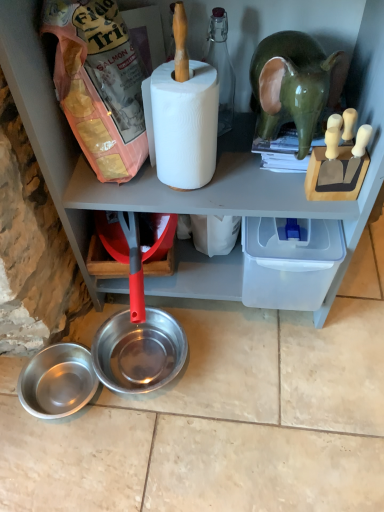
Question: Would you say green glossy elephant at upper right is outside white matte paper towel at center?

Choices:
 (A) yes
 (B) no

Answer: (A)

Question: Can you confirm if green glossy elephant at upper right is positioned to the left of white matte paper towel at center?

Choices:
 (A) no
 (B) yes

Answer: (A)

Question: From the image's perspective, does green glossy elephant at upper right appear lower than white matte paper towel at center?

Choices:
 (A) yes
 (B) no

Answer: (B)

Question: From a real-world perspective, is green glossy elephant at upper right beneath white matte paper towel at center?

Choices:
 (A) no
 (B) yes

Answer: (B)

Question: Is green glossy elephant at upper right oriented away from white matte paper towel at center?

Choices:
 (A) no
 (B) yes

Answer: (A)

Question: Choose the correct answer: Is white matte paper towel at center inside brushed metal bowl at lower left, the 1th bowl positioned from the left, or outside it?

Choices:
 (A) inside
 (B) outside

Answer: (B)

Question: In terms of width, does white matte paper towel at center look wider or thinner when compared to brushed metal bowl at lower left, which appears as the 2th bowl when viewed from the right?

Choices:
 (A) wide
 (B) thin

Answer: (B)

Question: From the image's perspective, is white matte paper towel at center located above or below brushed metal bowl at lower left, which appears as the 2th bowl when viewed from the right?

Choices:
 (A) below
 (B) above

Answer: (B)

Question: Based on their sizes in the image, would you say white matte paper towel at center is bigger or smaller than brushed metal bowl at lower left, the 1th bowl positioned from the left?

Choices:
 (A) big
 (B) small

Answer: (A)

Question: Is point (33, 402) positioned closer to the camera than point (104, 365)?

Choices:
 (A) closer
 (B) farther

Answer: (B)

Question: In the image, is brushed metal bowl at lower left, the 1th bowl positioned from the left, positioned in front of or behind shiny metallic bowl at lower center, which is counted as the 2th bowl, starting from the left?

Choices:
 (A) front
 (B) behind

Answer: (A)

Question: Is brushed metal bowl at lower left, the 1th bowl positioned from the left, inside or outside of shiny metallic bowl at lower center, which is counted as the 2th bowl, starting from the left?

Choices:
 (A) outside
 (B) inside

Answer: (A)

Question: Is brushed metal bowl at lower left, which appears as the 2th bowl when viewed from the right, to the left or to the right of shiny metallic bowl at lower center, which is counted as the 2th bowl, starting from the left, in the image?

Choices:
 (A) right
 (B) left

Answer: (B)

Question: Looking at their shapes, would you say matte pink plastic bag of dog food at upper left is wider or thinner than green glossy elephant at upper right?

Choices:
 (A) thin
 (B) wide

Answer: (A)

Question: In the image, is matte pink plastic bag of dog food at upper left on the left side or the right side of green glossy elephant at upper right?

Choices:
 (A) left
 (B) right

Answer: (A)